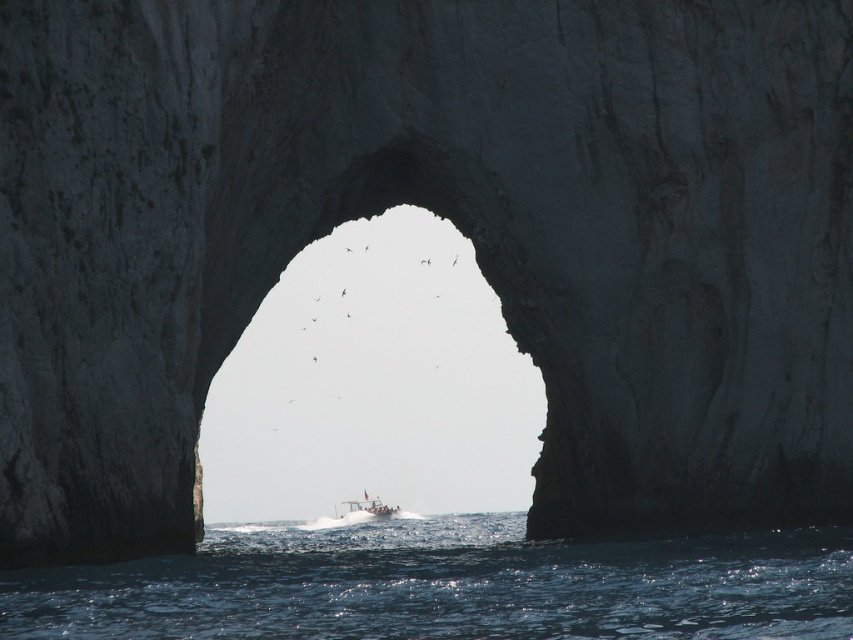
Question: Can you confirm if blue liquid water at lower center is positioned above white plastic boat at center?

Choices:
 (A) yes
 (B) no

Answer: (A)

Question: Among these points, which one is nearest to the camera?

Choices:
 (A) (373, 515)
 (B) (451, 605)

Answer: (B)

Question: Which of the following is the closest to the observer?

Choices:
 (A) white plastic boat at center
 (B) blue liquid water at lower center

Answer: (B)

Question: From the image, what is the correct spatial relationship of blue liquid water at lower center in relation to white plastic boat at center?

Choices:
 (A) below
 (B) above

Answer: (B)

Question: Does blue liquid water at lower center appear on the left side of white plastic boat at center?

Choices:
 (A) no
 (B) yes

Answer: (A)